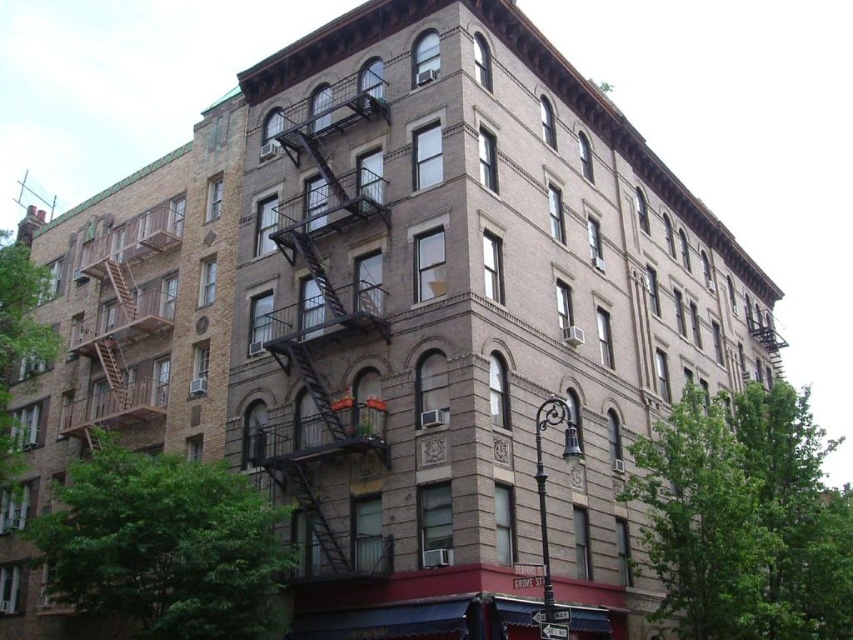
Question: Which point appears farthest from the camera in this image?

Choices:
 (A) (96, 323)
 (B) (380, 198)

Answer: (A)

Question: Can you confirm if black metal fire escape at center is positioned to the right of brown wooden fire escape at left?

Choices:
 (A) no
 (B) yes

Answer: (B)

Question: Can you confirm if black metal fire escape at center is positioned above brown wooden fire escape at left?

Choices:
 (A) yes
 (B) no

Answer: (A)

Question: Does black metal fire escape at center lie behind brown wooden fire escape at left?

Choices:
 (A) yes
 (B) no

Answer: (B)